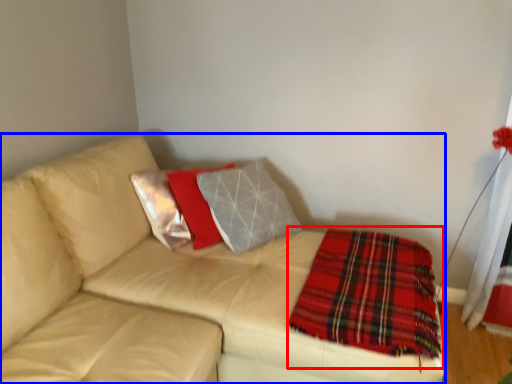
Question: Which point is closer to the camera, blanket (highlighted by a red box) or studio couch (highlighted by a blue box)?

Choices:
 (A) blanket
 (B) studio couch

Answer: (B)